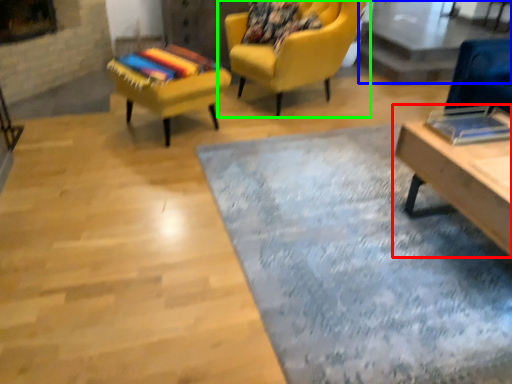
Question: Considering the real-world distances, which object is closest to table (highlighted by a red box)? glass table (highlighted by a blue box) or chair (highlighted by a green box).

Choices:
 (A) glass table
 (B) chair

Answer: (B)